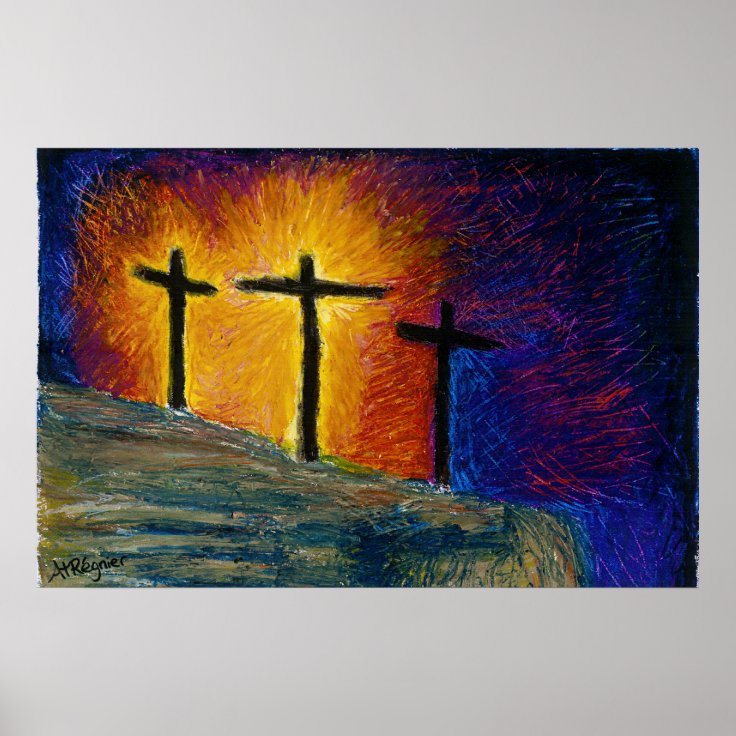
Locate an element on the screen. The width and height of the screenshot is (736, 736). painting is located at coordinates (367, 389).